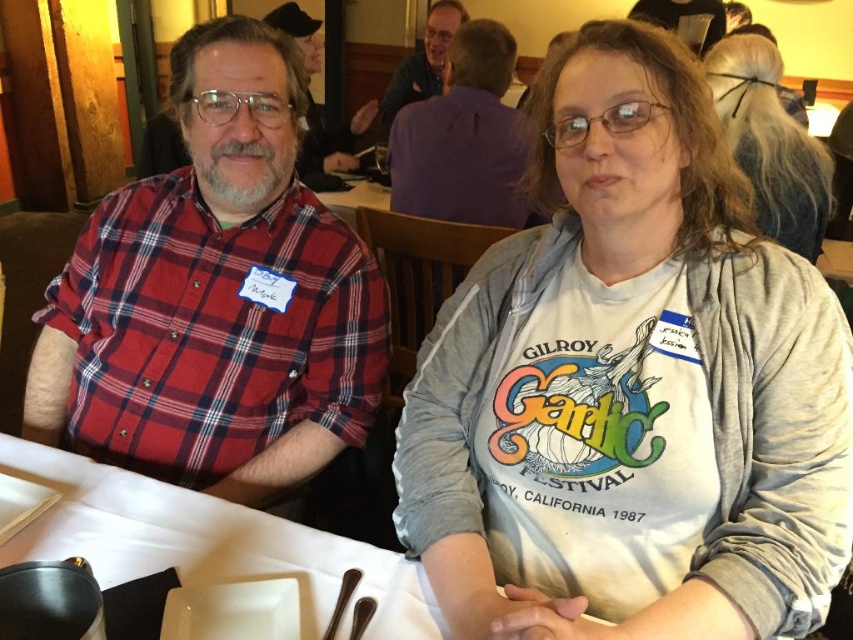
You are sitting at the table between the two people. Which of the two points, point (300, 188) or point (306, 90), is closer to you?

Point (300, 188) is in front of point (306, 90), so it is closer to you.

You are a photographer setting up for a group photo. You need to position the plaid fabric shirt at left and the gray fleece jacket at upper center so that they are aligned properly in the frame. According to their current positions, which object is positioned more to the right?

The plaid fabric shirt at left is positioned more to the right than the gray fleece jacket at upper center.

You are organizing a coat rack for guests at an event. You see the gray cotton hoodie at center and the gray fleece jacket at upper center on the table. Which item should you place on the lower hook to ensure proper hanging?

The gray cotton hoodie at center should be placed on the lower hook because it was originally located below the gray fleece jacket at upper center, indicating it belongs lower down.